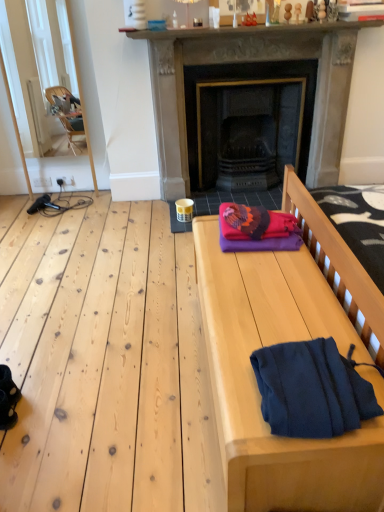
Question: From a real-world perspective, does smooth wooden bench at right stand above dark gray stone fireplace at center?

Choices:
 (A) yes
 (B) no

Answer: (B)

Question: Can you confirm if smooth wooden bench at right is positioned to the right of dark gray stone fireplace at center?

Choices:
 (A) no
 (B) yes

Answer: (A)

Question: From the image's perspective, would you say smooth wooden bench at right is shown under dark gray stone fireplace at center?

Choices:
 (A) yes
 (B) no

Answer: (A)

Question: Does smooth wooden bench at right have a greater height compared to dark gray stone fireplace at center?

Choices:
 (A) yes
 (B) no

Answer: (B)

Question: Are smooth wooden bench at right and dark gray stone fireplace at center far apart?

Choices:
 (A) no
 (B) yes

Answer: (B)

Question: Considering the positions of smooth wooden bench at right and smooth stone mantle at upper center in the image, is smooth wooden bench at right wider or thinner than smooth stone mantle at upper center?

Choices:
 (A) wide
 (B) thin

Answer: (A)

Question: Considering the positions of smooth wooden bench at right and smooth stone mantle at upper center in the image, is smooth wooden bench at right bigger or smaller than smooth stone mantle at upper center?

Choices:
 (A) big
 (B) small

Answer: (A)

Question: Does point [360, 436] appear closer or farther from the camera than point [147, 31]?

Choices:
 (A) farther
 (B) closer

Answer: (B)

Question: Is smooth wooden bench at right to the left or to the right of smooth stone mantle at upper center in the image?

Choices:
 (A) left
 (B) right

Answer: (A)

Question: Considering the positions of knitted woolen blanket at center and dark gray stone fireplace at center in the image, is knitted woolen blanket at center bigger or smaller than dark gray stone fireplace at center?

Choices:
 (A) big
 (B) small

Answer: (B)

Question: Is point (251, 214) positioned closer to the camera than point (296, 27)?

Choices:
 (A) farther
 (B) closer

Answer: (B)

Question: Considering their positions, is knitted woolen blanket at center located in front of or behind dark gray stone fireplace at center?

Choices:
 (A) front
 (B) behind

Answer: (A)

Question: Based on their positions, is knitted woolen blanket at center located to the left or right of dark gray stone fireplace at center?

Choices:
 (A) left
 (B) right

Answer: (A)

Question: From the image's perspective, is dark gray stone fireplace at center above or below smooth wooden bench at right?

Choices:
 (A) below
 (B) above

Answer: (B)

Question: Visually, is dark gray stone fireplace at center positioned to the left or to the right of smooth wooden bench at right?

Choices:
 (A) left
 (B) right

Answer: (B)